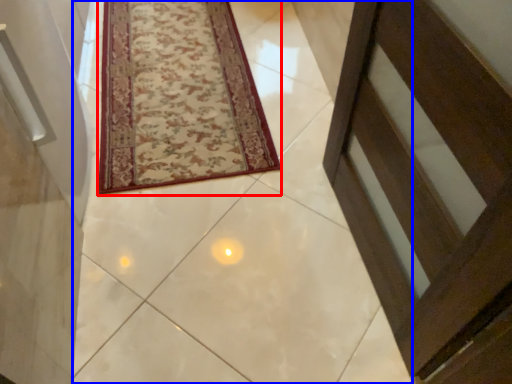
Question: Among these objects, which one is nearest to the camera, mat (highlighted by a red box) or path (highlighted by a blue box)?

Choices:
 (A) mat
 (B) path

Answer: (B)